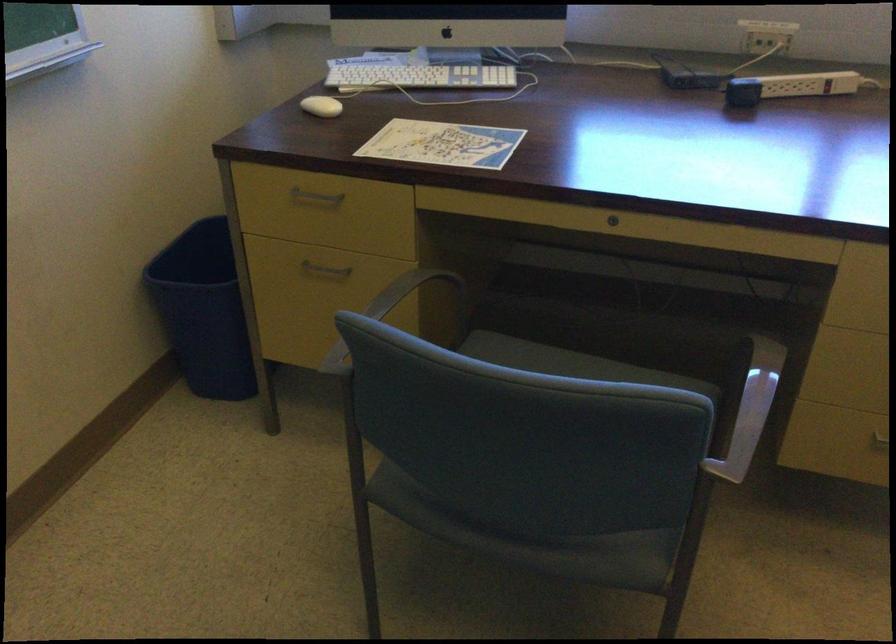
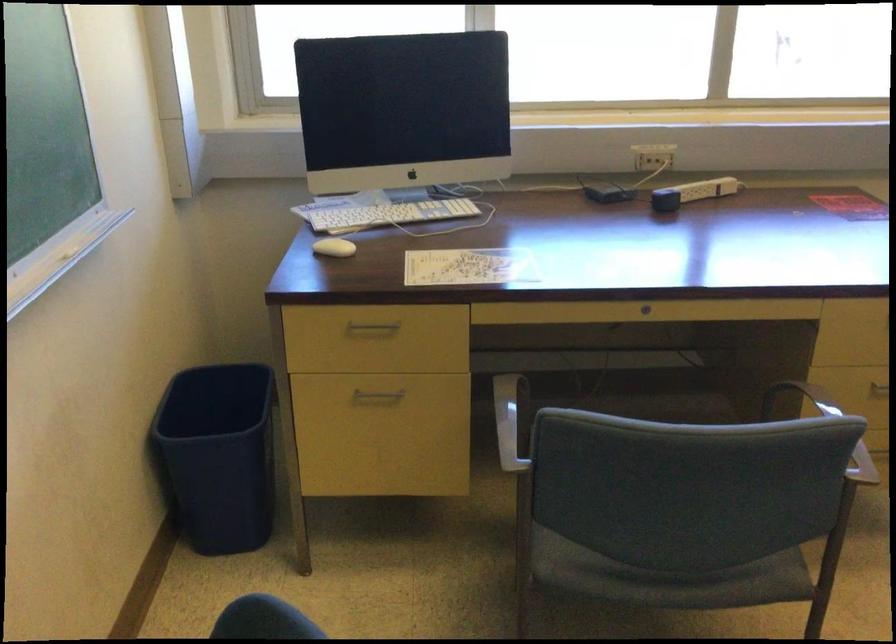
The point at (x=416, y=79) is marked in the first image. Where is the corresponding point in the second image?

(389, 214)